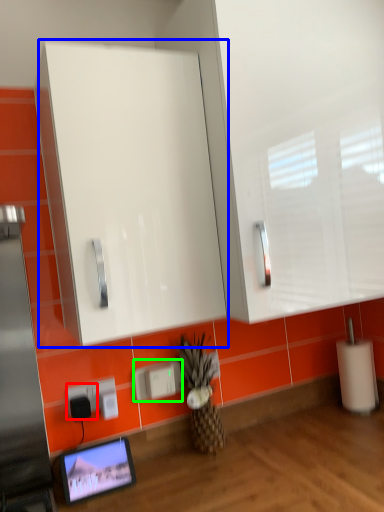
Question: Which object is the farthest from electric outlet (highlighted by a red box)? Choose among these: glass door (highlighted by a blue box) or electric outlet (highlighted by a green box).

Choices:
 (A) glass door
 (B) electric outlet

Answer: (A)